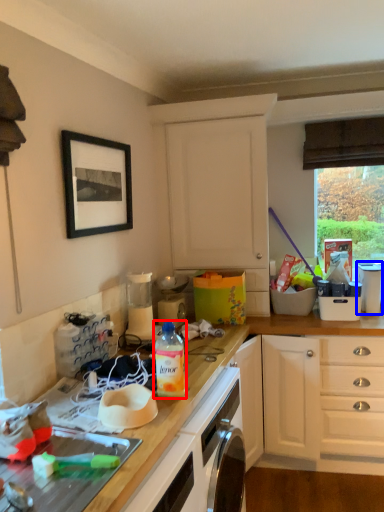
Question: Which object appears closest to the camera in this image, bottle (highlighted by a red box) or appliance (highlighted by a blue box)?

Choices:
 (A) bottle
 (B) appliance

Answer: (A)